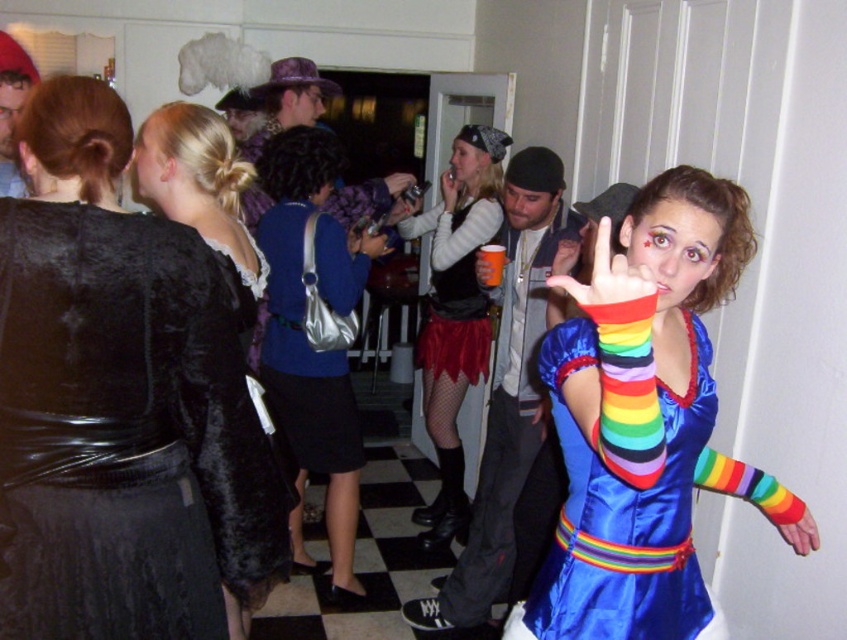
You are a photographer at the event and want to capture both the velvet black dress at upper left and the velvet red skirt at center in a single shot. Which one should you focus on first to ensure both are in focus?

You should focus on the velvet black dress at upper left first because it is closer to the viewer than the velvet red skirt at center, ensuring both will be in focus when using a shallow depth of field.

What color is the dress worn by the person at the point (120, 403) in the image?

The dress at point (120, 403) is velvet black.

Consider the image. You are a photographer at the event and need to capture a photo that includes both the rainbow satin dress at center and the shiny silver purse at center. Based on their positions, which object should you ensure is placed to the right side in the frame?

The rainbow satin dress at center should be placed to the right side in the frame because it is positioned on the right side of the shiny silver purse at center.